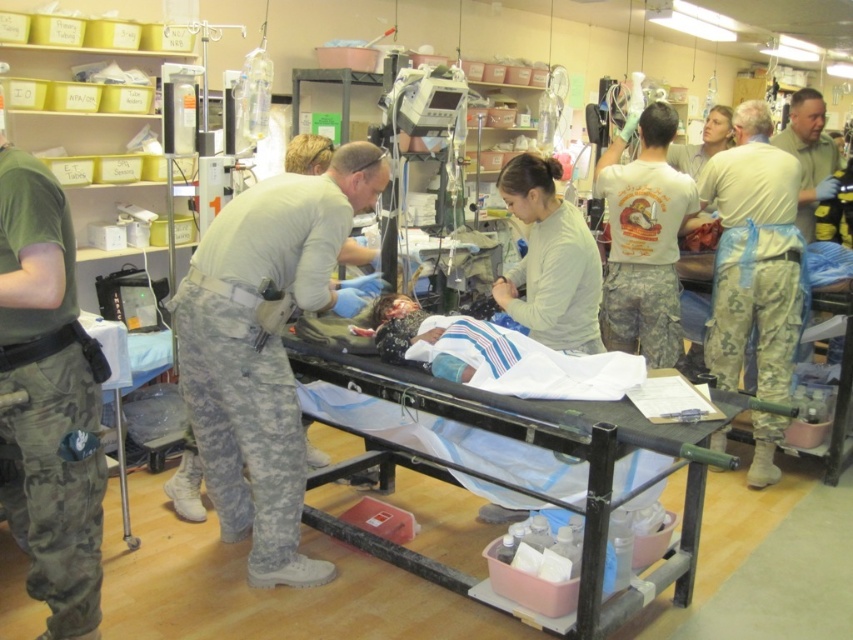
You are a medical drone operator trying to locate two critical points in the scene for emergency response. The first point is at coordinate point(221, 422) and the second is at point(654, 481). Which point is closer to you?

Point(221, 422) is closer to you than point(654, 481) because it is further to the viewer.

You are a nurse in the field hospital and need to quickly identify which staff member is closer to the patient for immediate assistance. Based on the uniforms, which staff member is positioned closer to the patient between the light beige uniform at right and the camouflage uniform at right?

The light beige uniform at right has a smaller size compared to camouflage uniform at right, so the light beige uniform at right is positioned closer to the patient.

You are a photographer trying to capture a clear image of the camouflage pants at center in the emergency scene. You have a camera that requires a minimum distance of 8 feet to avoid blurring. Based on the scene description, can you safely take the photo without moving the camera closer than necessary?

The camouflage pants at center and camera are 7.83 feet apart, which is less than the required 8 feet to avoid blurring. Therefore, you cannot safely take the photo without moving the camera further away to meet the distance requirement.